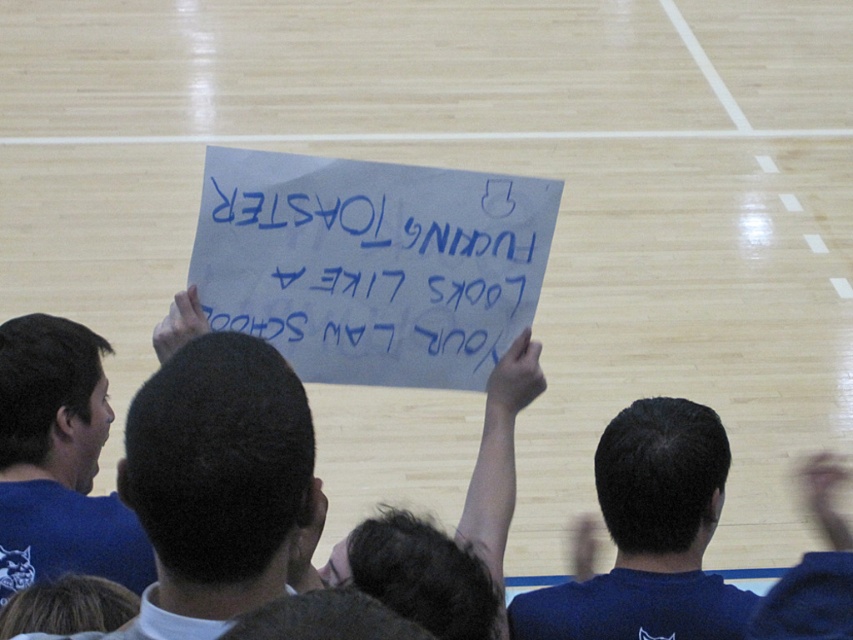
Where is the white paper sign at center located in the image?

The white paper sign at center is located at point 0.438 on the y axis and 0.417 on the x axis.

Looking at this image, you are a photographer trying to capture a clear photo of the white paper sign at center and the blue fabric shirt at upper center. The minimum distance your camera can focus on two objects clearly is 25 inches. Can you take the photo without moving the camera?

The white paper sign at center is 27.13 inches from the blue fabric shirt at upper center. Since the distance between them is greater than the camera minimum focus distance of 25 inches, you cannot take the photo without moving the camera.

You are a photographer at the event and need to capture a clear photo of both the white paper sign at center and the blue fabric shirt at upper center. Based on their positions, which object should you focus on first to ensure both are in frame?

The white paper sign at center is positioned on the right side of blue fabric shirt at upper center. Since the white paper sign at center is to the right of the blue fabric shirt at upper center, you should focus on the blue fabric shirt at upper center first to ensure both are in frame.